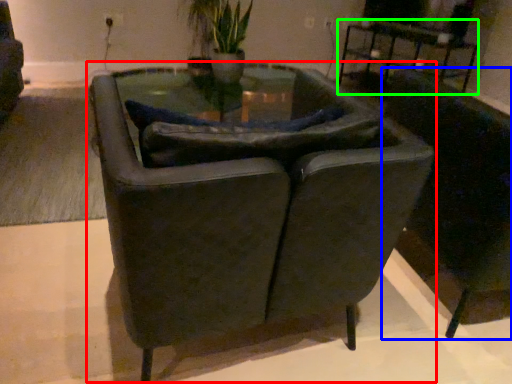
Question: Which is nearer to the chair (highlighted by a red box)? chair (highlighted by a blue box) or table (highlighted by a green box).

Choices:
 (A) chair
 (B) table

Answer: (A)